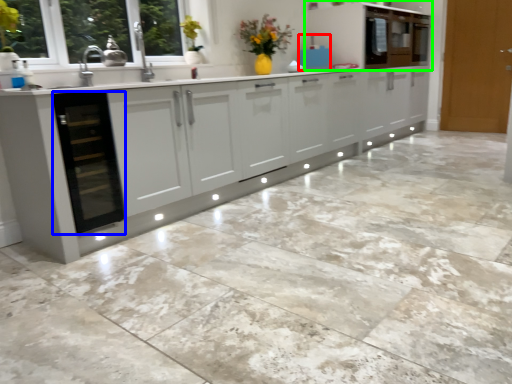
Question: Estimate the real-world distances between objects in this image. Which object is farther from appliance (highlighted by a red box), dish washer (highlighted by a blue box) or cabinetry (highlighted by a green box)?

Choices:
 (A) dish washer
 (B) cabinetry

Answer: (A)